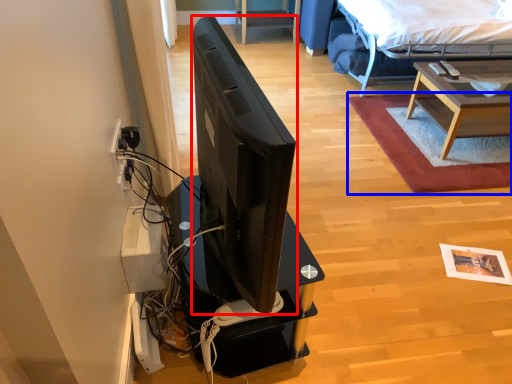
Question: Which point is further to the camera, television (highlighted by a red box) or plain (highlighted by a blue box)?

Choices:
 (A) television
 (B) plain

Answer: (B)